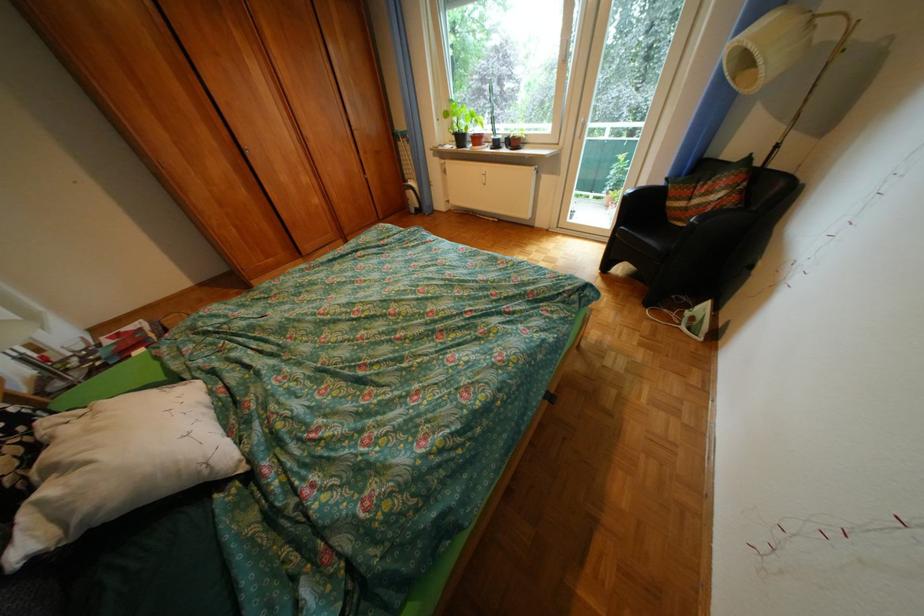
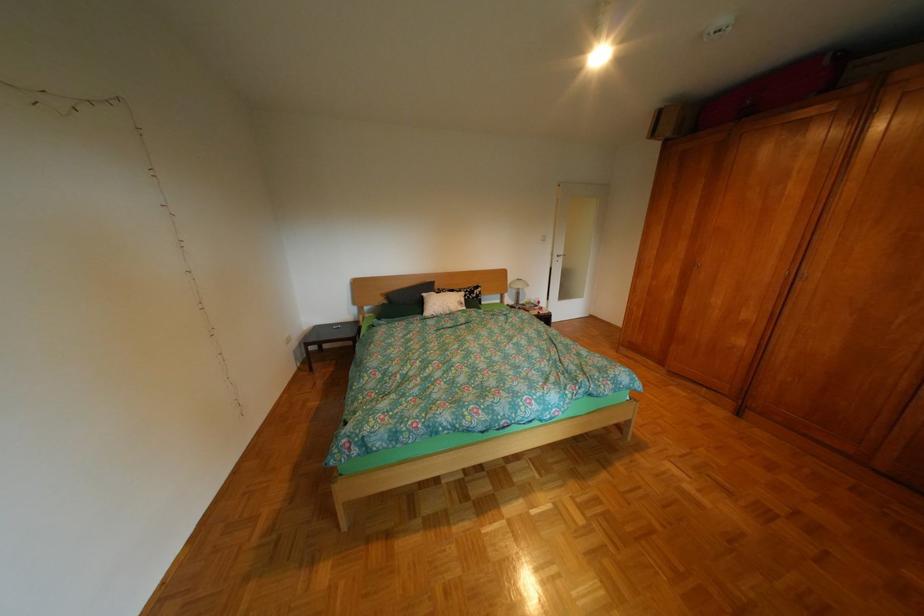
Locate, in the second image, the point that corresponds to (320,136) in the first image.

(819, 273)